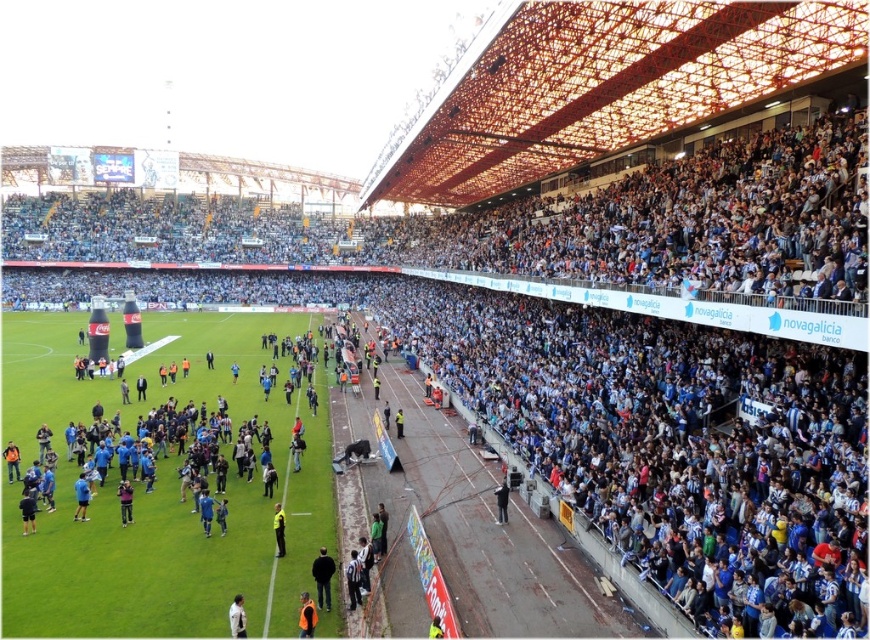
Question: Which point is closer to the camera taking this photo?

Choices:
 (A) click(245, 620)
 (B) click(84, 504)
 (C) click(121, 518)

Answer: (A)

Question: Does black fabric jacket at center appear on the right side of dark blue uniform at center?

Choices:
 (A) no
 (B) yes

Answer: (B)

Question: Which object is farther from the camera taking this photo?

Choices:
 (A) dark blue jersey at center
 (B) white matte shirt at lower left
 (C) light blue fabric jacket at center
 (D) reflective yellow vest at lower center

Answer: (C)

Question: Which point is farther from the camera taking this photo?

Choices:
 (A) (295, 467)
 (B) (236, 634)
 (C) (304, 618)
 (D) (499, 492)

Answer: (A)

Question: Is dark blue jersey at center bigger than dark blue uniform at center?

Choices:
 (A) yes
 (B) no

Answer: (B)

Question: Is blue fabric jacket at lower left to the right of black fabric jacket at center from the viewer's perspective?

Choices:
 (A) no
 (B) yes

Answer: (A)